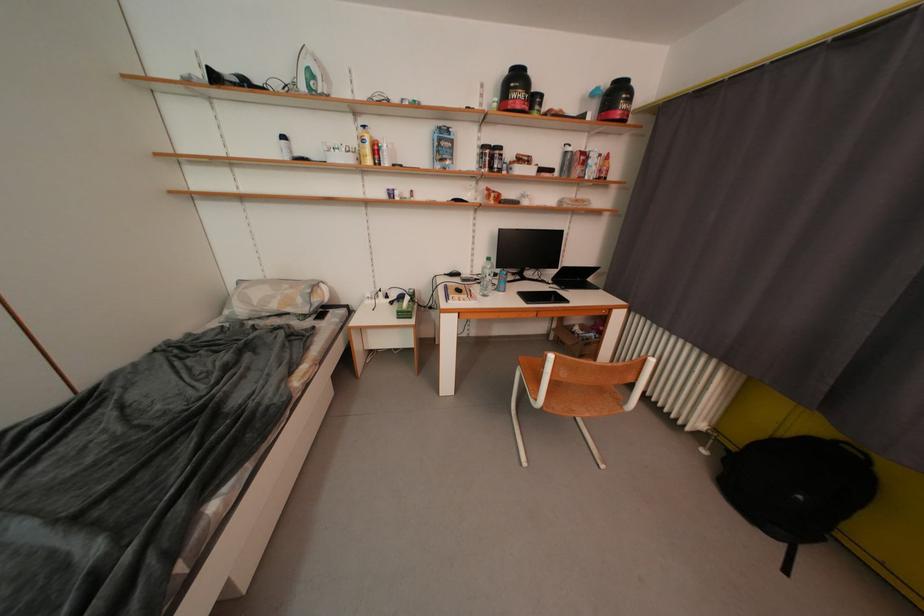
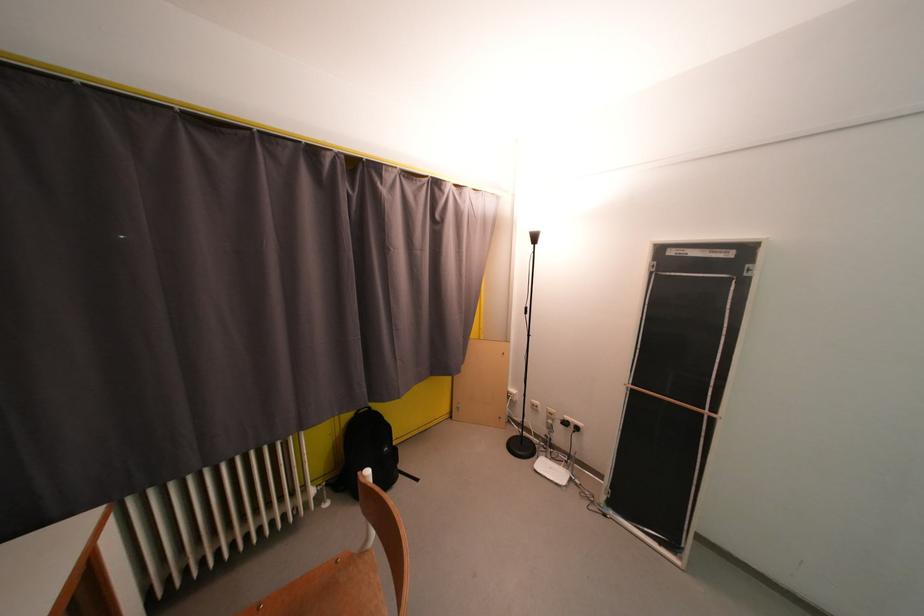
Find the pixel in the second image that matches point 878,466 in the first image.

(378, 411)